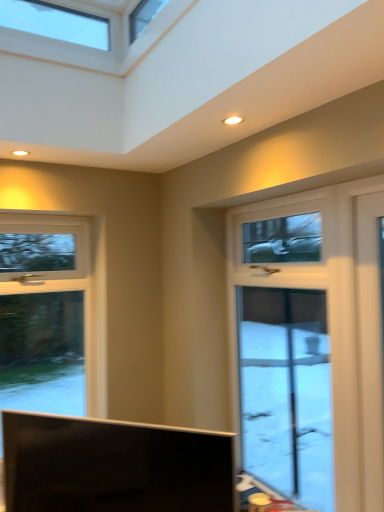
At what (x,y) coordinates should I click in order to perform the action: click on matte black tv at lower center. Please return your answer as a coordinate pair (x, y). Image resolution: width=384 pixels, height=512 pixels. Looking at the image, I should click on (113, 466).

Image resolution: width=384 pixels, height=512 pixels. What do you see at coordinates (113, 466) in the screenshot? I see `matte black tv at lower center` at bounding box center [113, 466].

The image size is (384, 512). Find the location of `white glossy door at right`. white glossy door at right is located at coordinates (309, 344).

Image resolution: width=384 pixels, height=512 pixels. Describe the element at coordinates (309, 344) in the screenshot. I see `white glossy door at right` at that location.

Find the location of a particular element. matte black tv at lower center is located at coordinates (113, 466).

Looking at this image, does matte black tv at lower center appear on the right side of white glossy door at right?

No, matte black tv at lower center is not to the right of white glossy door at right.

Who is more distant, matte black tv at lower center or white glossy door at right?

white glossy door at right is more distant.

Does point (124, 435) appear closer or farther from the camera than point (261, 412)?

Clearly, point (124, 435) is closer to the camera than point (261, 412).

From the image's perspective, is matte black tv at lower center located beneath white glossy door at right?

Yes.

From a real-world perspective, is matte black tv at lower center positioned under white glossy door at right based on gravity?

Yes, from a real-world perspective, matte black tv at lower center is under white glossy door at right.

Which object is thinner, matte black tv at lower center or white glossy door at right?

white glossy door at right is thinner.

Is matte black tv at lower center shorter than white glossy door at right?

Indeed, matte black tv at lower center has a lesser height compared to white glossy door at right.

Considering the sizes of objects matte black tv at lower center and white glossy door at right in the image provided, who is bigger, matte black tv at lower center or white glossy door at right?

Bigger between the two is matte black tv at lower center.

Would you say matte black tv at lower center contains white glossy door at right?

That's incorrect, white glossy door at right is not inside matte black tv at lower center.

Are matte black tv at lower center and white glossy door at right far apart?

matte black tv at lower center is positioned a significant distance from white glossy door at right.

Is matte black tv at lower center turned away from white glossy door at right?

No.

How many degrees apart are the facing directions of matte black tv at lower center and white glossy door at right?

They differ by 41.7 degrees in their facing directions.

How much distance is there between matte black tv at lower center and white glossy door at right?

matte black tv at lower center and white glossy door at right are 4.14 feet apart.

You are a GUI agent. You are given a task and a screenshot of the screen. Output one action in this format:
    pyautogui.click(x=<x>, y=<y>)
    Task: Click on the television in front of the white glossy door at right
    This screenshot has height=512, width=384.
    Given the screenshot: What is the action you would take?
    pyautogui.click(x=113, y=466)

Does white glossy door at right appear on the right side of matte black tv at lower center?

Correct, you'll find white glossy door at right to the right of matte black tv at lower center.

Which object is further away from the camera taking this photo, white glossy door at right or matte black tv at lower center?

white glossy door at right is further away from the camera.

Is point (276, 321) in front of point (207, 452)?

No, it is not.

From the image's perspective, would you say white glossy door at right is positioned over matte black tv at lower center?

Yes.

From a real-world perspective, who is located lower, white glossy door at right or matte black tv at lower center?

In real-world perspective, matte black tv at lower center is lower.

In the scene shown: Considering the relative sizes of white glossy door at right and matte black tv at lower center in the image provided, is white glossy door at right thinner than matte black tv at lower center?

Yes.

Based on the photo, does white glossy door at right have a lesser height compared to matte black tv at lower center?

Incorrect, the height of white glossy door at right does not fall short of that of matte black tv at lower center.

Does white glossy door at right have a smaller size compared to matte black tv at lower center?

Yes.

Is white glossy door at right completely or partially outside of matte black tv at lower center?

That's correct, white glossy door at right is outside of matte black tv at lower center.

Is there a large distance between white glossy door at right and matte black tv at lower center?

white glossy door at right is far away from matte black tv at lower center.

Is matte black tv at lower center at the back of white glossy door at right?

No, white glossy door at right's orientation is not away from matte black tv at lower center.

Measure the distance between white glossy door at right and matte black tv at lower center.

white glossy door at right is 1.26 meters away from matte black tv at lower center.

Locate an element on the screen. television in front of the white glossy door at right is located at coordinates (113, 466).

You are a GUI agent. You are given a task and a screenshot of the screen. Output one action in this format:
    pyautogui.click(x=<x>, y=<y>)
    Task: Click on the window above the matte black tv at lower center (from a real-world perspective)
    
    Given the screenshot: What is the action you would take?
    [309, 344]

In the image, there is a matte black tv at lower center. Identify the location of window above it (from the image's perspective). The image size is (384, 512). (309, 344).